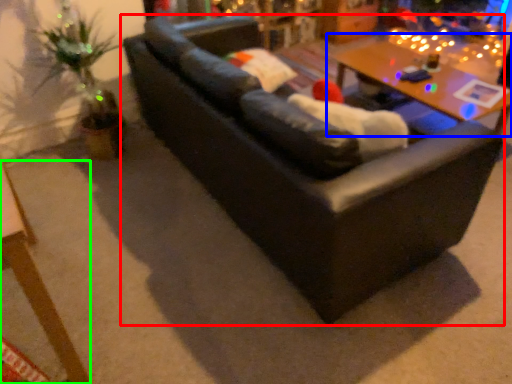
Question: Based on their relative distances, which object is farther from studio couch (highlighted by a red box)? Choose from table (highlighted by a blue box) and table (highlighted by a green box).

Choices:
 (A) table
 (B) table

Answer: (A)